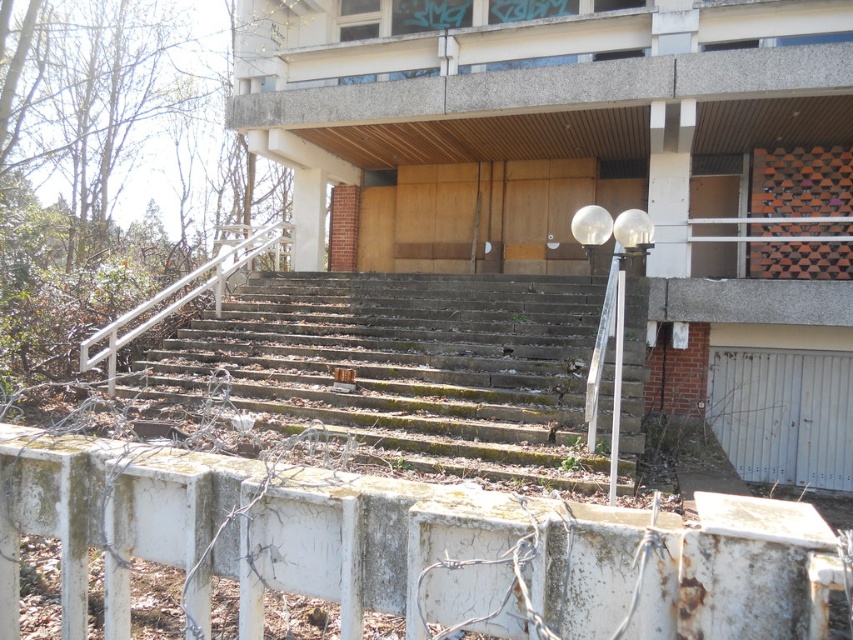
You are a maintenance worker assessing the outdoor area. You notice the rusty concrete stairs at center and the white metal railing at left. Which object is located below the other?

The rusty concrete stairs at center are positioned below the white metal railing at left.

You are a painter hired to paint the rusty concrete stairs at center and the white metal railing at left. You need to know which object requires more paint. Based on the scene description, which one would need more paint?

The white metal railing at left requires more paint because it is larger than the rusty concrete stairs at center.

From the picture: You are standing at the base of the weathered concrete stairs leading to the building. You want to take a photo of the point at coordinates (210, 336). If your camera has a maximum focus range of 10 meters, will it be able to focus on that point?

The distance between the point at coordinates (210, 336) and the camera is 9.96 meters, which is within the camera maximum focus range of 10 meters. Therefore, the camera can focus on the point at coordinates (210, 336).